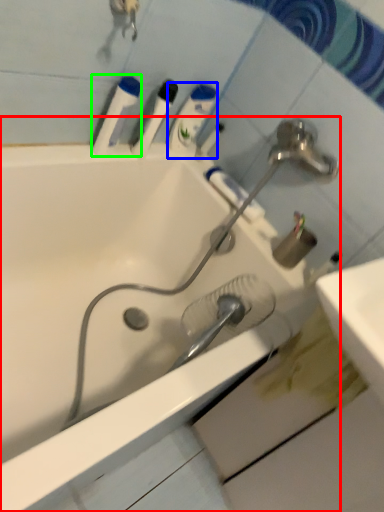
Question: Which object is positioned closest to bathtub (highlighted by a red box)? Select from mouthwash (highlighted by a blue box) and mouthwash (highlighted by a green box).

Choices:
 (A) mouthwash
 (B) mouthwash

Answer: (B)